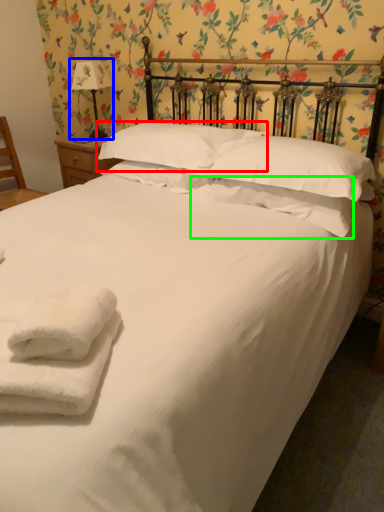
Question: Considering the real-world distances, which object is farthest from pillow (highlighted by a red box)? table lamp (highlighted by a blue box) or pillow (highlighted by a green box)?

Choices:
 (A) table lamp
 (B) pillow

Answer: (A)